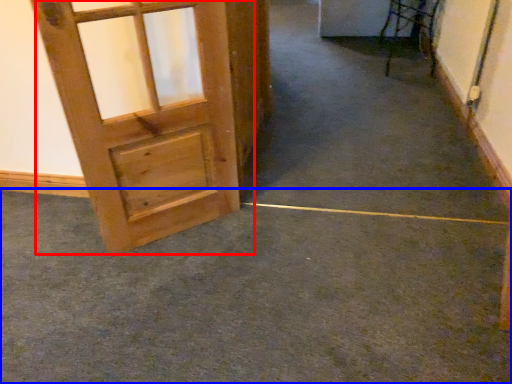
Question: Which object appears farthest to the camera in this image, door (highlighted by a red box) or concrete (highlighted by a blue box)?

Choices:
 (A) door
 (B) concrete

Answer: (A)